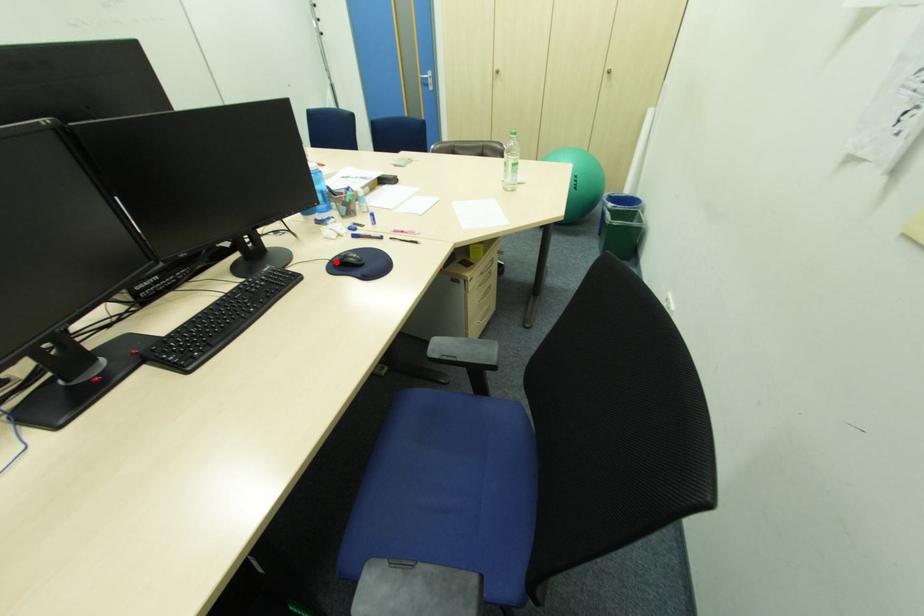
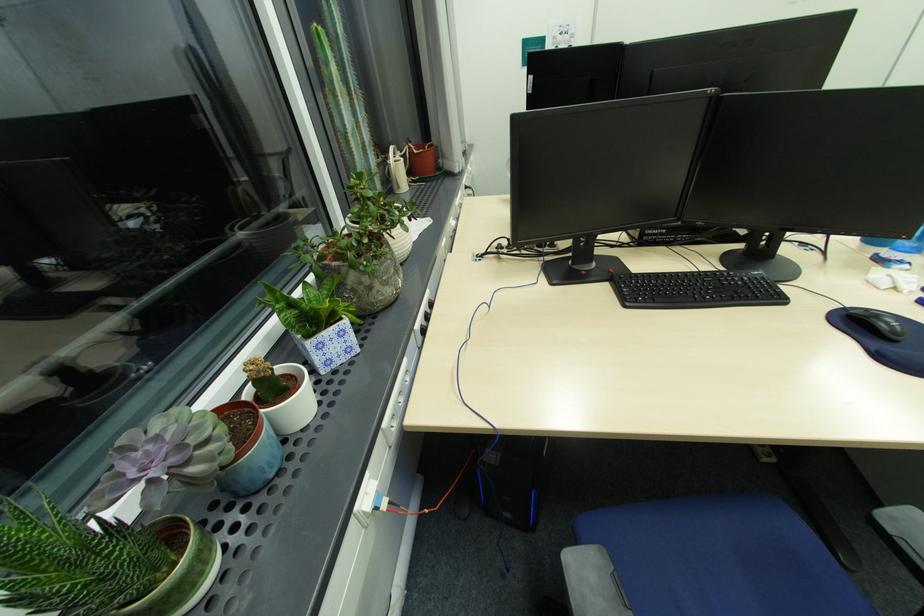
Where in the second image is the point corresponding to the highlighted location from the first image?

(849, 310)